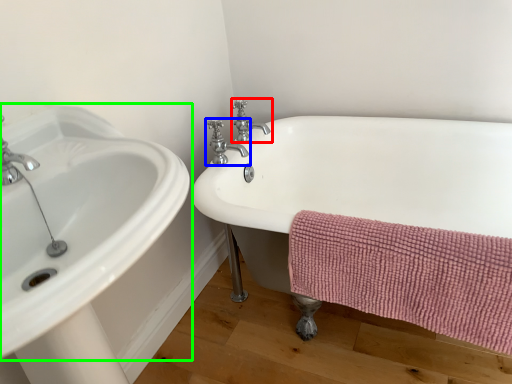
Question: Considering the real-world distances, which object is closest to tap (highlighted by a red box)? tap (highlighted by a blue box) or sink (highlighted by a green box).

Choices:
 (A) tap
 (B) sink

Answer: (A)